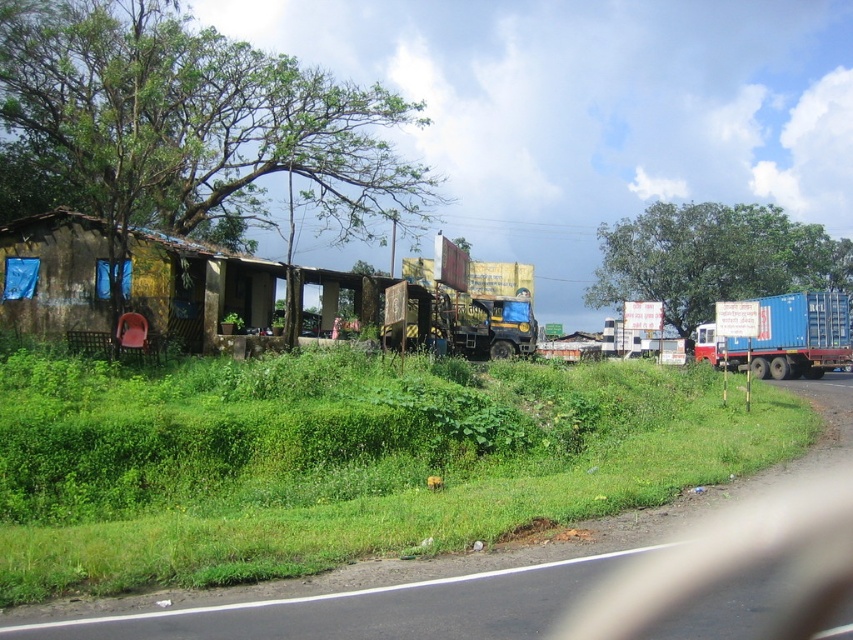
Question: Based on their relative distances, which object is nearer to the blue matte container at right?

Choices:
 (A) yellow matte trailer truck at center
 (B) green grass at lower left
 (C) rusty corrugated metal hut at left

Answer: (A)

Question: Estimate the real-world distances between objects in this image. Which object is farther from the blue matte container at right?

Choices:
 (A) rusty corrugated metal hut at left
 (B) yellow matte trailer truck at center

Answer: (A)

Question: Is rusty corrugated metal hut at left positioned before yellow matte trailer truck at center?

Choices:
 (A) no
 (B) yes

Answer: (B)

Question: Is green grass at lower left smaller than rusty corrugated metal hut at left?

Choices:
 (A) yes
 (B) no

Answer: (A)

Question: From the image, what is the correct spatial relationship of green grass at lower left in relation to yellow matte trailer truck at center?

Choices:
 (A) right
 (B) left

Answer: (B)

Question: Which point appears closest to the camera in this image?

Choices:
 (A) pyautogui.click(x=787, y=312)
 (B) pyautogui.click(x=62, y=301)
 (C) pyautogui.click(x=207, y=508)
 (D) pyautogui.click(x=503, y=268)

Answer: (C)